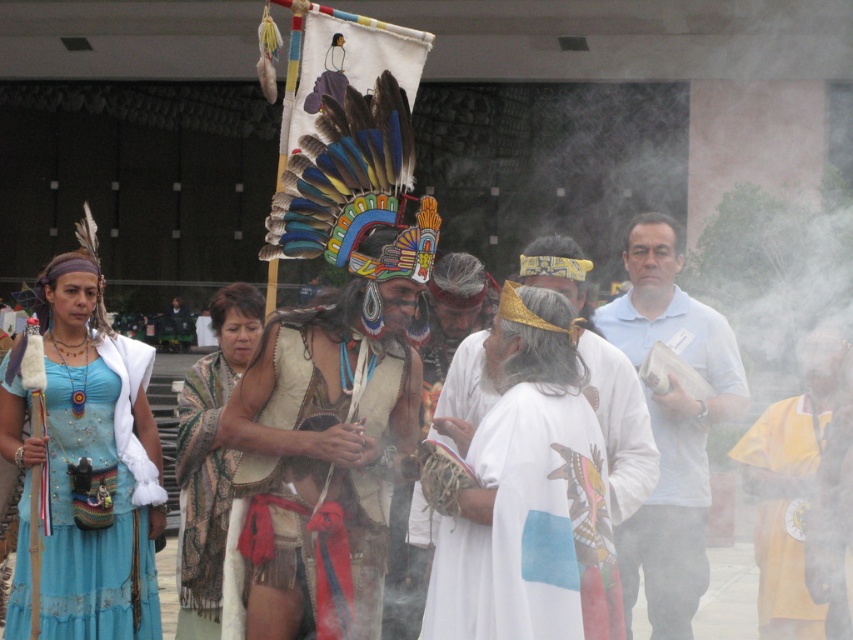
Does white cotton shirt at center have a greater width compared to patterned fabric shawl at center?

Indeed, white cotton shirt at center has a greater width compared to patterned fabric shawl at center.

Which is more to the right, white cotton shirt at center or patterned fabric shawl at center?

Positioned to the right is white cotton shirt at center.

Is point (622, 586) positioned after point (198, 618)?

No, it is in front of (198, 618).

Where is `white cotton shirt at center`? This screenshot has height=640, width=853. white cotton shirt at center is located at coordinates (671, 424).

Does white matte/soft fabric at center have a smaller size compared to white cotton shirt at center?

→ Correct, white matte/soft fabric at center occupies less space than white cotton shirt at center.

Can you confirm if white matte/soft fabric at center is shorter than white cotton shirt at center?

Yes, white matte/soft fabric at center is shorter than white cotton shirt at center.

Locate an element on the screen. Image resolution: width=853 pixels, height=640 pixels. white matte/soft fabric at center is located at coordinates (524, 493).

Between matte blue dress at left and yellow fabric shawl at right, which one has less height?

Standing shorter between the two is matte blue dress at left.

Between point (76, 532) and point (782, 550), which one is positioned behind?

Positioned behind is point (782, 550).

Image resolution: width=853 pixels, height=640 pixels. I want to click on matte blue dress at left, so click(x=88, y=467).

Find the location of a particular element. The height and width of the screenshot is (640, 853). matte blue dress at left is located at coordinates (88, 467).